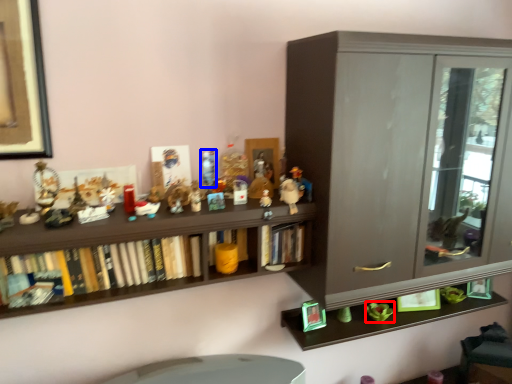
Question: Which object is closer to the camera taking this photo, toy (highlighted by a red box) or toy (highlighted by a blue box)?

Choices:
 (A) toy
 (B) toy

Answer: (B)